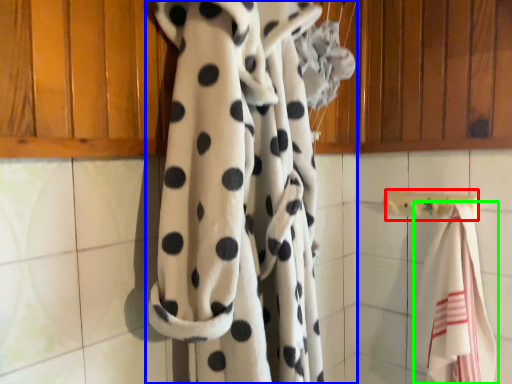
Question: Which object is the farthest from towel bar (highlighted by a red box)? Choose among these: curtain (highlighted by a blue box) or towel (highlighted by a green box).

Choices:
 (A) curtain
 (B) towel

Answer: (A)